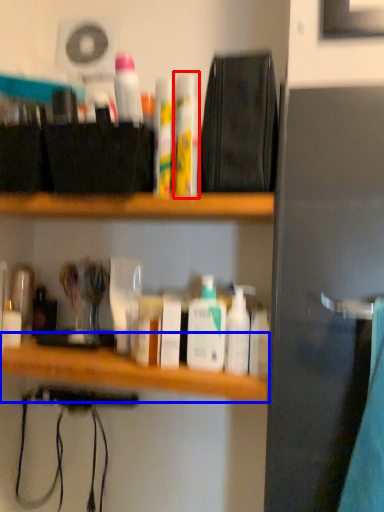
Question: Which point is further to the camera, toiletry (highlighted by a red box) or counter (highlighted by a blue box)?

Choices:
 (A) toiletry
 (B) counter

Answer: (A)